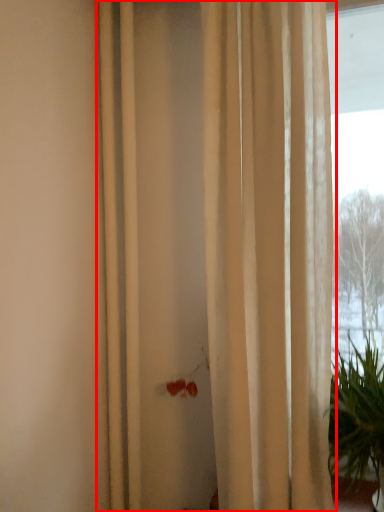
Question: From the image, what is the correct spatial relationship of curtain (annotated by the red box) in relation to houseplant?

Choices:
 (A) left
 (B) right

Answer: (A)